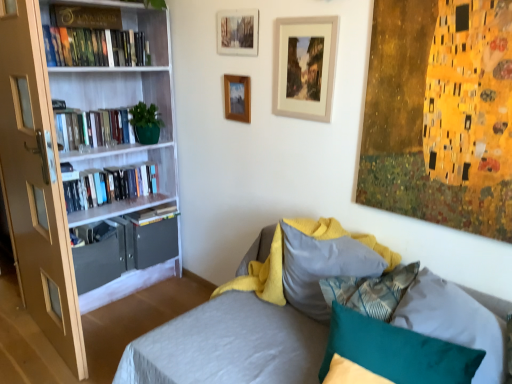
Question: From the image's perspective, does hardcover book at left, which appears as the 2th book when viewed from the top, appear higher than hardcover books at left, which is counted as the 2th book, starting from the bottom?

Choices:
 (A) no
 (B) yes

Answer: (B)

Question: From the image's perspective, is hardcover book at left, which is counted as the fourth book, starting from the bottom, below hardcover books at left, which is the fourth book in top-to-bottom order?

Choices:
 (A) no
 (B) yes

Answer: (A)

Question: Can you confirm if hardcover book at left, which is counted as the fourth book, starting from the bottom, is positioned to the left of hardcover books at left, which is counted as the 2th book, starting from the bottom?

Choices:
 (A) no
 (B) yes

Answer: (A)

Question: Would you say hardcover book at left, which appears as the 2th book when viewed from the top, contains hardcover books at left, which is counted as the 2th book, starting from the bottom?

Choices:
 (A) no
 (B) yes

Answer: (A)

Question: Is hardcover book at left, which is counted as the fourth book, starting from the bottom, completely or partially outside of hardcover books at left, which is the fourth book in top-to-bottom order?

Choices:
 (A) no
 (B) yes

Answer: (B)

Question: Is wooden picture frame at upper center, placed as the first picture frame when sorted from left to right, bigger or smaller than wooden picture frame at upper center, the first picture frame in the right-to-left sequence?

Choices:
 (A) big
 (B) small

Answer: (B)

Question: Would you say wooden picture frame at upper center, placed as the first picture frame when sorted from left to right, is inside or outside wooden picture frame at upper center, the third picture frame from the left?

Choices:
 (A) inside
 (B) outside

Answer: (B)

Question: Does point (229, 82) appear closer or farther from the camera than point (313, 29)?

Choices:
 (A) closer
 (B) farther

Answer: (B)

Question: In terms of height, does wooden picture frame at upper center, which is the 3th picture frame from right to left, look taller or shorter compared to wooden picture frame at upper center, the first picture frame in the right-to-left sequence?

Choices:
 (A) short
 (B) tall

Answer: (A)

Question: From their relative heights in the image, would you say wooden picture frame at upper center, which is the 3th picture frame from right to left, is taller or shorter than hardcover books at left, which is the fourth book in top-to-bottom order?

Choices:
 (A) short
 (B) tall

Answer: (B)

Question: Does point click(238, 99) appear closer or farther from the camera than point click(143, 183)?

Choices:
 (A) closer
 (B) farther

Answer: (A)

Question: From a real-world perspective, is wooden picture frame at upper center, which is the 3th picture frame from right to left, above or below hardcover books at left, which is counted as the 2th book, starting from the bottom?

Choices:
 (A) above
 (B) below

Answer: (A)

Question: Relative to hardcover books at left, which is the fourth book in top-to-bottom order, is wooden picture frame at upper center, placed as the first picture frame when sorted from left to right, in front or behind?

Choices:
 (A) front
 (B) behind

Answer: (A)

Question: Is hardcover books at left, the third book positioned from the top, to the left or to the right of teal fabric pillow at lower right, which appears as the second pillow when viewed from the back, in the image?

Choices:
 (A) left
 (B) right

Answer: (A)

Question: Is point (57, 117) positioned closer to the camera than point (457, 380)?

Choices:
 (A) closer
 (B) farther

Answer: (B)